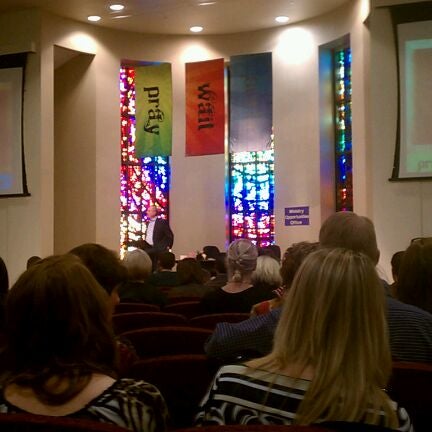
Find the location of a particular element. The image size is (432, 432). stained glass window is located at coordinates (254, 201).